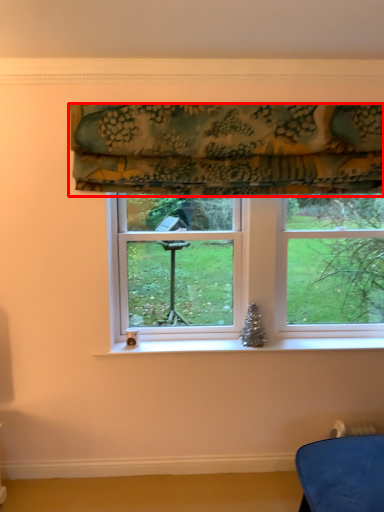
Question: Where is curtain (annotated by the red box) located in relation to window in the image?

Choices:
 (A) right
 (B) left

Answer: (B)